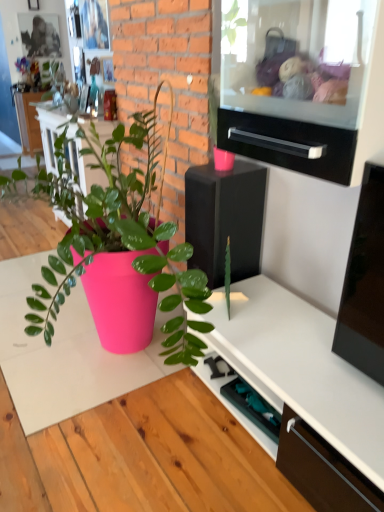
The height and width of the screenshot is (512, 384). Find the location of `free point above black glossy drawer at upper center (from a real-world perspective)`. free point above black glossy drawer at upper center (from a real-world perspective) is located at coordinates (287, 113).